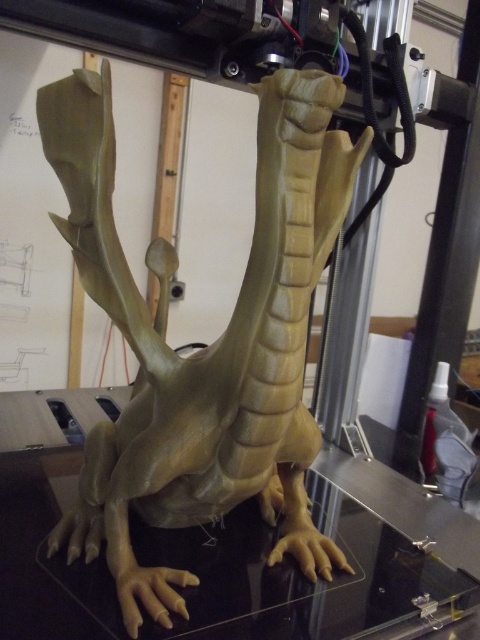
You are a 3D printer operator and need to place a small sticker on the matte yellow dinosaur at center. According to the coordinate system where the bottom left corner is the origin, what are the coordinates where you should place the sticker?

The coordinates for placing the sticker on the matte yellow dinosaur at center are at point (206,346).

You are a visitor at a science museum and see the matte yellow dinosaur at center and the transparent glass table at center. Which object is taller?

The matte yellow dinosaur at center is much taller than the transparent glass table at center.

From the picture: You are a 3D printer technician and you need to check the stability of the matte yellow dinosaur at center. Since the transparent glass table at center is the only support, is the dinosaur likely to tip over?

The matte yellow dinosaur at center is positioned over transparent glass table at center. Since the dinosaur is centered on the table, it is likely stable and less prone to tipping over.